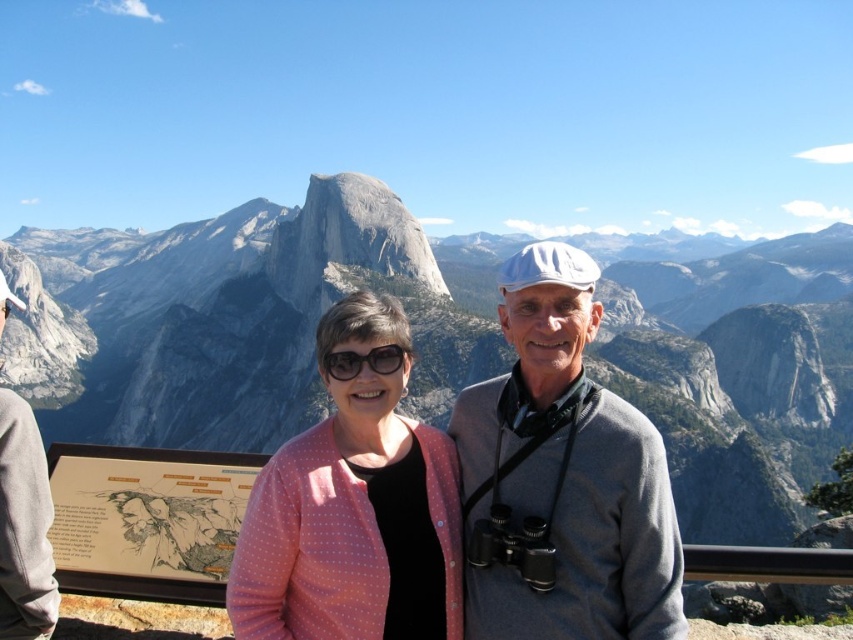
Question: Which object is positioned closest to the gray/granite rock at center?

Choices:
 (A) pink dotted cardigan at center
 (B) gray wool sweater at center

Answer: (B)

Question: Is gray wool sweater at center smaller than gray/granite rock at center?

Choices:
 (A) yes
 (B) no

Answer: (A)

Question: Is gray rock formation at center smaller than gray wool sweater at center?

Choices:
 (A) yes
 (B) no

Answer: (B)

Question: Is the position of gray wool sweater at center more distant than that of gray/granite rock at center?

Choices:
 (A) no
 (B) yes

Answer: (A)

Question: Which object appears closest to the camera in this image?

Choices:
 (A) pink dotted cardigan at center
 (B) gray wool sweater at center
 (C) matte black glasses at center

Answer: (A)

Question: Which object is closer to the camera taking this photo?

Choices:
 (A) gray wool sweater at center
 (B) gray rock formation at center

Answer: (A)